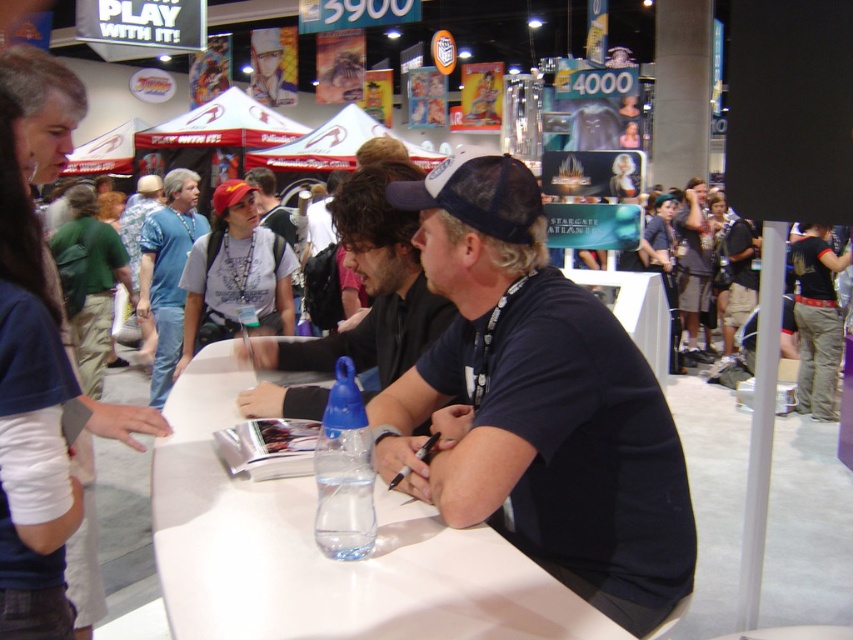
Question: From the image, what is the correct spatial relationship of black mesh cap at center in relation to white glossy table at center?

Choices:
 (A) above
 (B) below

Answer: (A)

Question: Where is black mesh cap at center located in relation to white glossy table at center in the image?

Choices:
 (A) above
 (B) below

Answer: (A)

Question: Among these points, which one is farthest from the camera?

Choices:
 (A) (426, 326)
 (B) (699, 192)
 (C) (556, 605)

Answer: (B)

Question: Is black matte cap at center bigger than denim shorts at right?

Choices:
 (A) yes
 (B) no

Answer: (B)

Question: Which of these objects is positioned closest to the white glossy table at center?

Choices:
 (A) black matte cap at center
 (B) denim shorts at right
 (C) black mesh cap at center

Answer: (C)

Question: Which object is positioned farthest from the black matte cap at center?

Choices:
 (A) white glossy table at center
 (B) denim shorts at right
 (C) black mesh cap at center

Answer: (B)